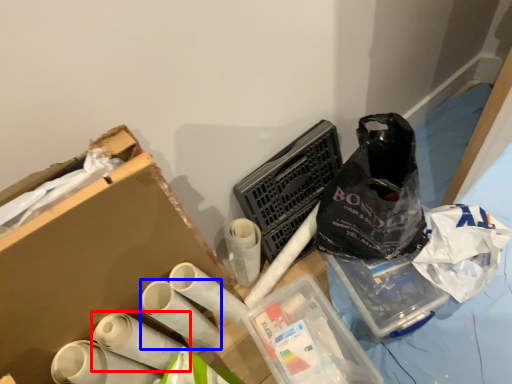
Question: Which object is closer to the camera taking this photo, toilet paper (highlighted by a red box) or toilet paper (highlighted by a blue box)?

Choices:
 (A) toilet paper
 (B) toilet paper

Answer: (A)